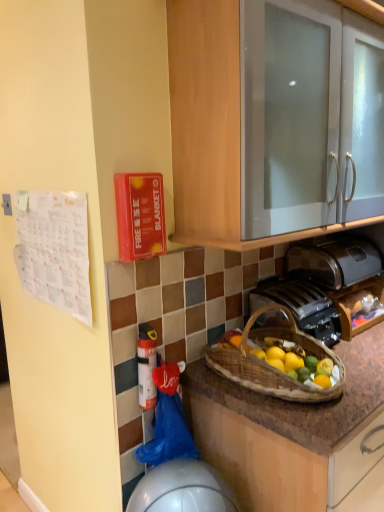
In order to click on vacant area on top of metallic silver toaster at lower center (from a real-world perspective) in this screenshot , I will do `click(289, 285)`.